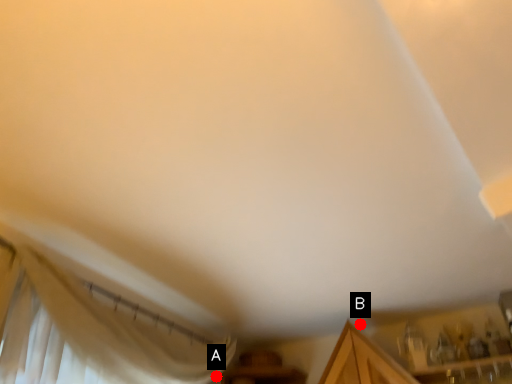
Question: Two points are circled on the image, labeled by A and B beside each circle. Which point is farther from the camera taking this photo?

Choices:
 (A) A is further
 (B) B is further

Answer: (B)